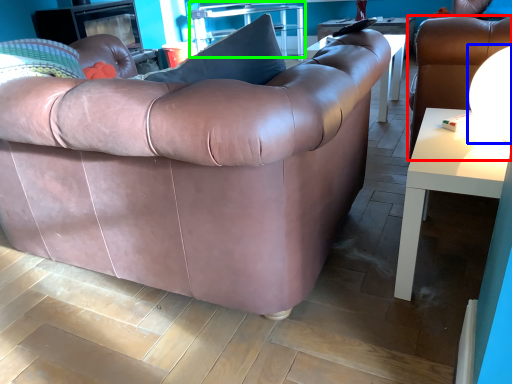
Question: Considering the real-world distances, which object is closest to chair (highlighted by a red box)? lamp (highlighted by a blue box) or table (highlighted by a green box).

Choices:
 (A) lamp
 (B) table

Answer: (A)